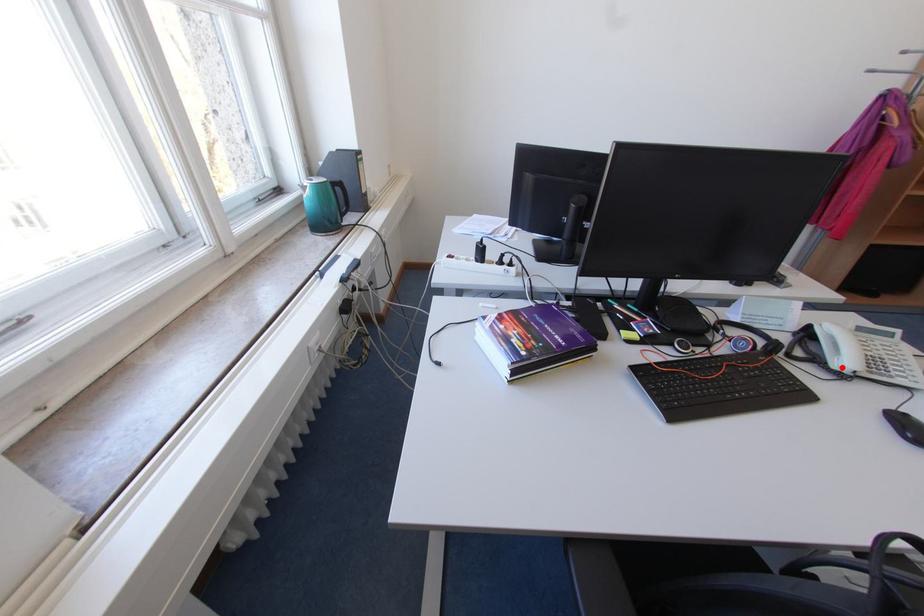
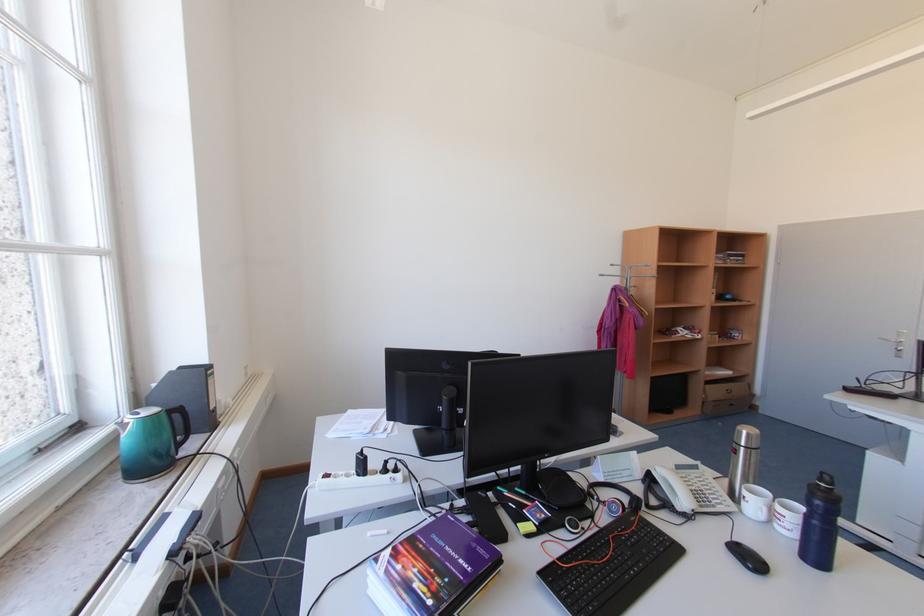
The point at the highlighted location is marked in the first image. Where is the corresponding point in the second image?

(687, 509)